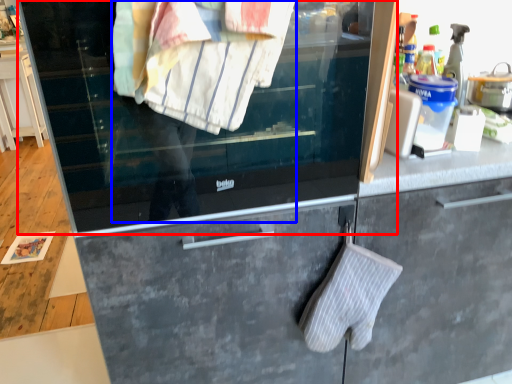
Question: Which of the following is the closest to the observer, window (highlighted by a red box) or person (highlighted by a blue box)?

Choices:
 (A) window
 (B) person

Answer: (B)